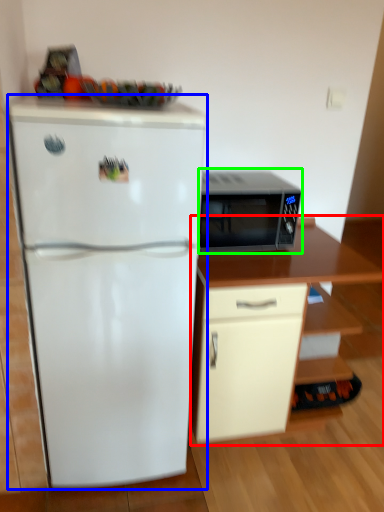
Question: Considering the real-world distances, which object is closest to cabinetry (highlighted by a red box)? refrigerator (highlighted by a blue box) or microwave oven (highlighted by a green box).

Choices:
 (A) refrigerator
 (B) microwave oven

Answer: (B)